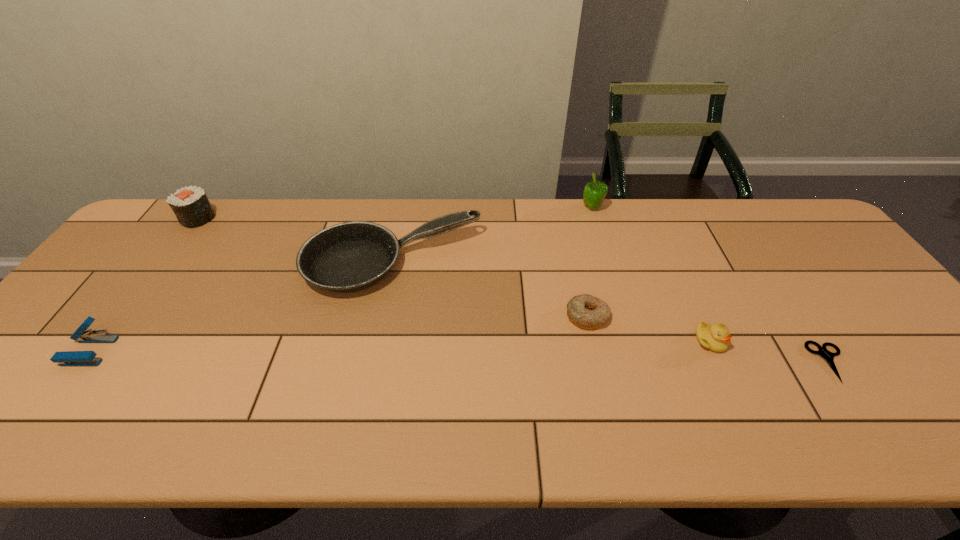
Locate an element on the screen. Image resolution: width=960 pixels, height=540 pixels. frying pan located in the far edge section of the desktop is located at coordinates (351, 256).

At what (x,y) coordinates should I click in order to perform the action: click on sushi at the left edge. Please return your answer as a coordinate pair (x, y). This screenshot has height=540, width=960. Looking at the image, I should click on (190, 205).

Where is `stapler situated at the left edge`? stapler situated at the left edge is located at coordinates (67, 358).

Locate an element on the screen. This screenshot has height=540, width=960. object at the far left corner is located at coordinates (190, 205).

Locate an element on the screen. The width and height of the screenshot is (960, 540). blank space at the far edge is located at coordinates (613, 238).

Locate an element on the screen. The height and width of the screenshot is (540, 960). vacant space at the near edge is located at coordinates (388, 437).

In the image, there is a desktop. At what (x,y) coordinates should I click in order to perform the action: click on vacant space at the left edge. Please return your answer as a coordinate pair (x, y). Looking at the image, I should click on (8, 396).

This screenshot has width=960, height=540. I want to click on free space at the right edge, so click(x=921, y=353).

Where is `vacant point located between the frying pan and the bell pepper`? Image resolution: width=960 pixels, height=540 pixels. vacant point located between the frying pan and the bell pepper is located at coordinates (492, 236).

The image size is (960, 540). Find the location of `vacant space in between the duckling and the rightmost object`. vacant space in between the duckling and the rightmost object is located at coordinates (770, 352).